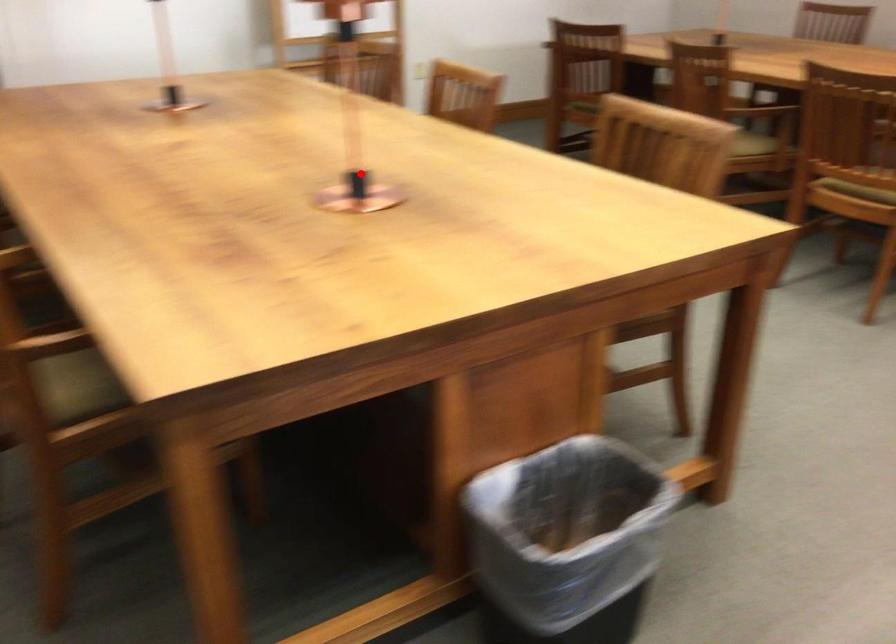
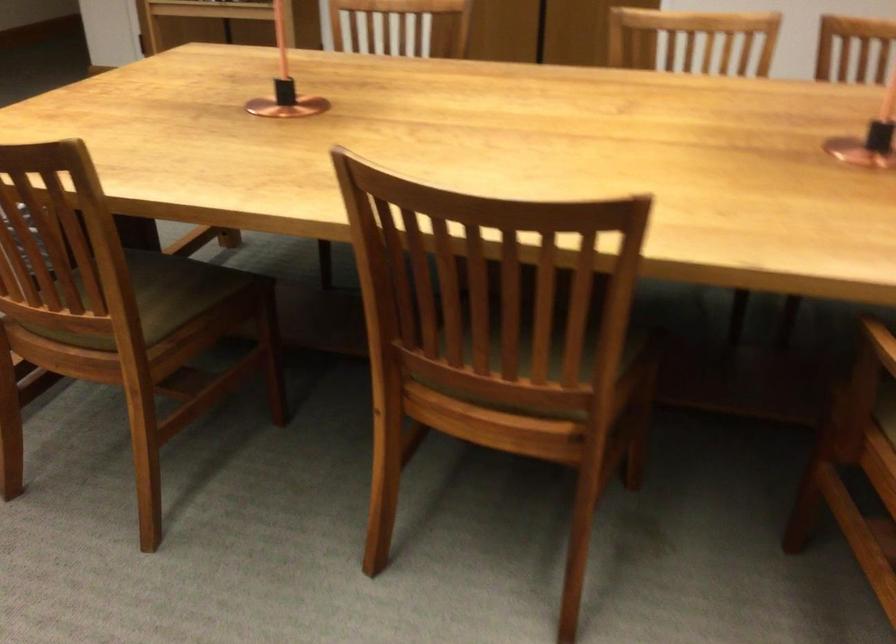
The point at the highlighted location is marked in the first image. Where is the corresponding point in the second image?

(285, 84)